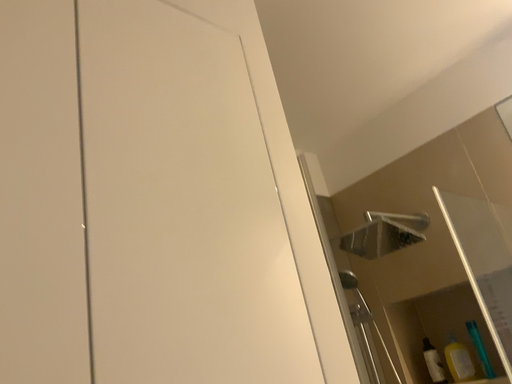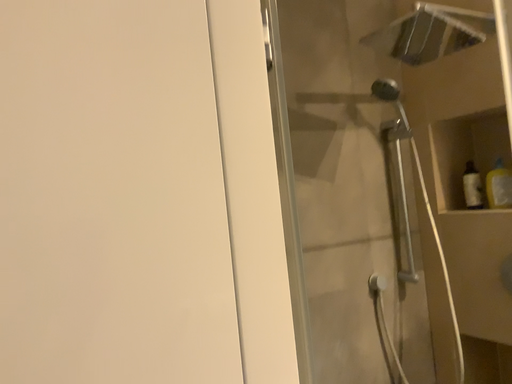
Question: Which way did the camera rotate in the video?

Choices:
 (A) rotated upward
 (B) rotated downward

Answer: (B)